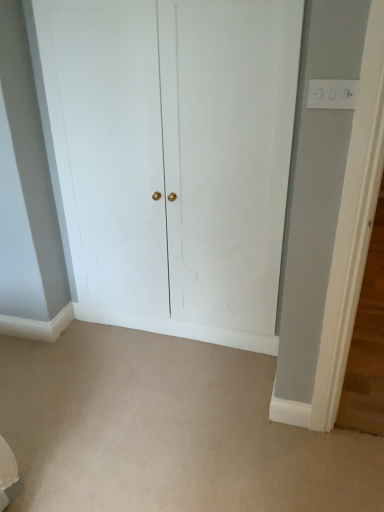
The image size is (384, 512). Identify the location of beige carpet at center. (167, 430).

Describe the element at coordinates (167, 430) in the screenshot. I see `beige carpet at center` at that location.

Measure the distance between point (78, 387) and camera.

They are 2.14 meters apart.

Describe the element at coordinates (173, 159) in the screenshot. I see `white matte door at center` at that location.

Locate an element on the screen. This screenshot has height=512, width=384. white matte door at center is located at coordinates (173, 159).

I want to click on beige carpet at center, so click(167, 430).

Considering the relative positions of beige carpet at center and white matte door at center in the image provided, is beige carpet at center to the right of white matte door at center from the viewer's perspective?

In fact, beige carpet at center is to the left of white matte door at center.

In the scene shown: Considering the relative positions of beige carpet at center and white matte door at center in the image provided, is beige carpet at center in front of white matte door at center?

Yes, beige carpet at center is closer to the viewer.

Does point (170, 384) come behind point (109, 292)?

No, it is in front of (109, 292).

From the image's perspective, is beige carpet at center above or below white matte door at center?

Clearly, from the image's perspective, beige carpet at center is below white matte door at center.

Based on the photo, from a real-world perspective, is beige carpet at center located beneath white matte door at center?

Yes, from a real-world perspective, beige carpet at center is under white matte door at center.

Considering the relative sizes of beige carpet at center and white matte door at center in the image provided, is beige carpet at center thinner than white matte door at center?

Incorrect, the width of beige carpet at center is not less than that of white matte door at center.

In terms of height, does beige carpet at center look taller or shorter compared to white matte door at center?

beige carpet at center is shorter than white matte door at center.

Looking at this image, is beige carpet at center smaller than white matte door at center?

Correct, beige carpet at center occupies less space than white matte door at center.

Would you say beige carpet at center is outside white matte door at center?

Yes, beige carpet at center is outside of white matte door at center.

Is there a large distance between beige carpet at center and white matte door at center?

No, beige carpet at center is not far away from white matte door at center.

Does beige carpet at center turn towards white matte door at center?

No, beige carpet at center is not turned towards white matte door at center.

I want to click on door above the beige carpet at center (from a real-world perspective), so click(173, 159).

Considering the relative positions of white matte door at center and beige carpet at center in the image provided, is white matte door at center to the left or to the right of beige carpet at center?

From the image, it's evident that white matte door at center is to the right of beige carpet at center.

Is the depth of white matte door at center less than that of beige carpet at center?

No.

Which point is more distant from viewer, (64, 138) or (285, 507)?

Point (64, 138)

From the image's perspective, which one is positioned higher, white matte door at center or beige carpet at center?

From the image's view, white matte door at center is above.

From a real-world perspective, which is physically below, white matte door at center or beige carpet at center?

beige carpet at center.

Considering the sizes of objects white matte door at center and beige carpet at center in the image provided, who is thinner, white matte door at center or beige carpet at center?

With smaller width is white matte door at center.

Considering the sizes of objects white matte door at center and beige carpet at center in the image provided, who is taller, white matte door at center or beige carpet at center?

Standing taller between the two is white matte door at center.

From the picture: Considering the relative sizes of white matte door at center and beige carpet at center in the image provided, is white matte door at center bigger than beige carpet at center?

Correct, white matte door at center is larger in size than beige carpet at center.

Can beige carpet at center be found inside white matte door at center?

That's incorrect, beige carpet at center is not inside white matte door at center.

Is white matte door at center next to beige carpet at center and touching it?

No, white matte door at center is not in contact with beige carpet at center.

Is white matte door at center facing towards beige carpet at center?

Yes, white matte door at center faces towards beige carpet at center.

The image size is (384, 512). I want to click on plain located in front of the white matte door at center, so coord(167,430).

This screenshot has height=512, width=384. I want to click on plain located on the left of white matte door at center, so click(x=167, y=430).

This screenshot has width=384, height=512. What are the coordinates of `plain in front of the white matte door at center` in the screenshot? It's located at (167, 430).